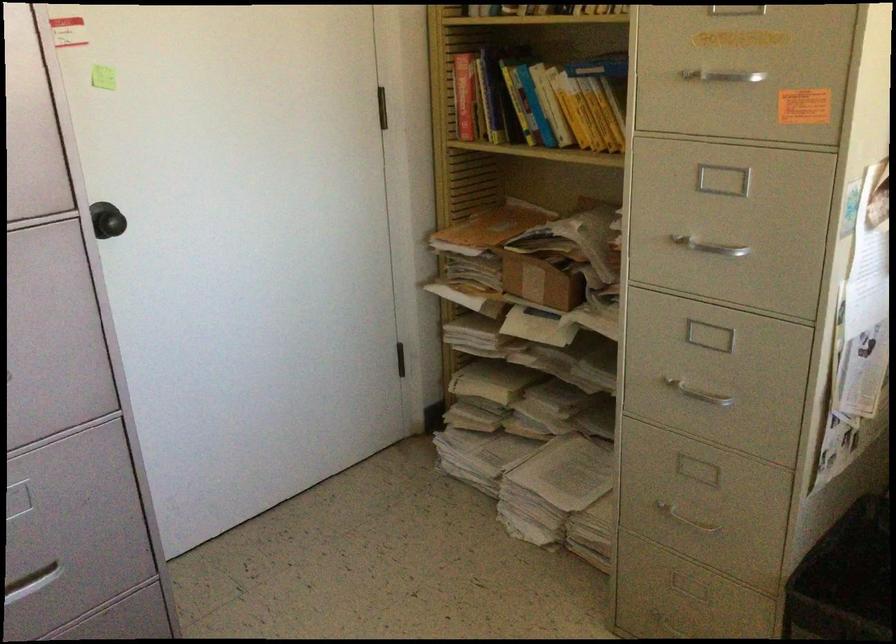
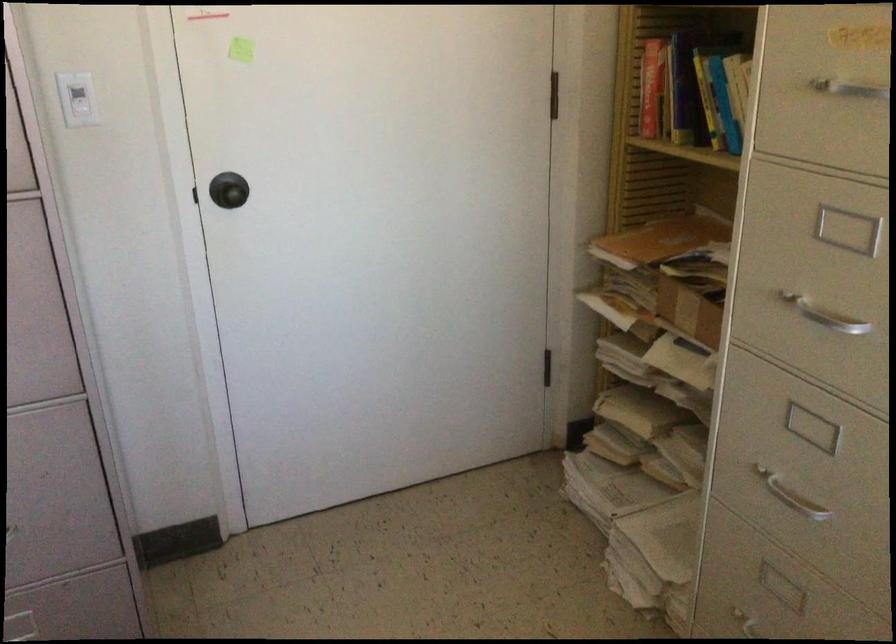
Find the pixel in the second image that matches pixel 538 281 in the first image.

(688, 310)